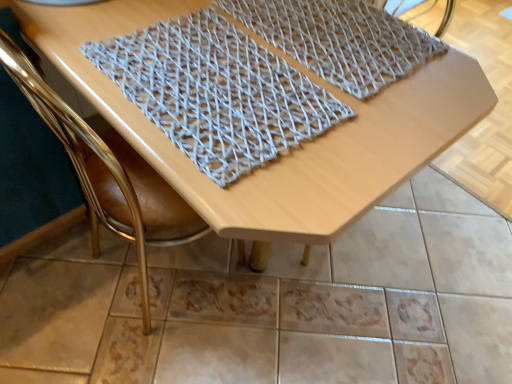
Identify the location of knitted fabric at center, placed as the 1th blanket when sorted from left to right. (216, 92).

This screenshot has height=384, width=512. What do you see at coordinates (216, 92) in the screenshot?
I see `knitted fabric at center, placed as the 1th blanket when sorted from left to right` at bounding box center [216, 92].

The width and height of the screenshot is (512, 384). In order to click on gray woven mat at upper center, acting as the 1th blanket starting from the right in this screenshot , I will do `click(339, 39)`.

Can gold leather chair at upper left be found inside gray woven mat at upper center, acting as the 1th blanket starting from the right?

Actually, gold leather chair at upper left is outside gray woven mat at upper center, acting as the 1th blanket starting from the right.

In the image, is gray woven mat at upper center, which is counted as the second blanket, starting from the left, positioned in front of or behind gold leather chair at upper left?

In the image, gray woven mat at upper center, which is counted as the second blanket, starting from the left, appears behind gold leather chair at upper left.

Considering the relative positions of gray woven mat at upper center, acting as the 1th blanket starting from the right, and gold leather chair at upper left in the image provided, is gray woven mat at upper center, acting as the 1th blanket starting from the right, to the left of gold leather chair at upper left from the viewer's perspective?

No.

Who is taller, gray woven mat at upper center, which is counted as the second blanket, starting from the left, or gold leather chair at upper left?

Standing taller between the two is gold leather chair at upper left.

Are gold leather chair at upper left and gray woven mat at upper center, which is counted as the second blanket, starting from the left, making contact?

No, gold leather chair at upper left is not with gray woven mat at upper center, which is counted as the second blanket, starting from the left.

This screenshot has width=512, height=384. What are the coordinates of `the 2nd blanket above the gold leather chair at upper left (from the image's perspective)` in the screenshot? It's located at (339, 39).

Does gold leather chair at upper left appear on the right side of gray woven mat at upper center, which is counted as the second blanket, starting from the left?

In fact, gold leather chair at upper left is to the left of gray woven mat at upper center, which is counted as the second blanket, starting from the left.

In terms of height, does knitted fabric at center, which ranks as the 2th blanket in right-to-left order, look taller or shorter compared to wooden table at center?

In the image, knitted fabric at center, which ranks as the 2th blanket in right-to-left order, appears to be shorter than wooden table at center.

Is knitted fabric at center, which ranks as the 2th blanket in right-to-left order, positioned in front of wooden table at center?

No, knitted fabric at center, which ranks as the 2th blanket in right-to-left order, is further to the viewer.

Could you measure the distance between knitted fabric at center, placed as the 1th blanket when sorted from left to right, and wooden table at center?

They are 3.33 inches apart.

From a real-world perspective, which object rests below the other?

wooden table at center, from a real-world perspective.

Is wooden table at center facing towards gray woven mat at upper center, acting as the 1th blanket starting from the right?

No, wooden table at center is not aimed at gray woven mat at upper center, acting as the 1th blanket starting from the right.

Is gray woven mat at upper center, acting as the 1th blanket starting from the right, inside wooden table at center?

Yes, wooden table at center contains gray woven mat at upper center, acting as the 1th blanket starting from the right.

From the image's perspective, which object appears higher, wooden table at center or gray woven mat at upper center, which is counted as the second blanket, starting from the left?

gray woven mat at upper center, which is counted as the second blanket, starting from the left, is shown above in the image.

Where is `the 2nd blanket above the wooden table at center (from the image's perspective)`? the 2nd blanket above the wooden table at center (from the image's perspective) is located at coordinates (339, 39).

Considering the sizes of objects knitted fabric at center, which ranks as the 2th blanket in right-to-left order, and gold leather chair at upper left in the image provided, who is bigger, knitted fabric at center, which ranks as the 2th blanket in right-to-left order, or gold leather chair at upper left?

gold leather chair at upper left is bigger.

Based on the photo, is the depth of knitted fabric at center, which ranks as the 2th blanket in right-to-left order, greater than that of gold leather chair at upper left?

Yes, knitted fabric at center, which ranks as the 2th blanket in right-to-left order, is further from the camera.

From a real-world perspective, starting from the gold leather chair at upper left, which blanket is the 1st one vertically above it? Please provide its 2D coordinates.

[(216, 92)]

Is knitted fabric at center, which ranks as the 2th blanket in right-to-left order, far away from gold leather chair at upper left?

knitted fabric at center, which ranks as the 2th blanket in right-to-left order, is near gold leather chair at upper left, not far away.

Which of these two, gold leather chair at upper left or wooden table at center, stands shorter?

wooden table at center.

Is point (93, 236) farther from viewer compared to point (389, 143)?

Yes, point (93, 236) is farther from viewer.

From the image's perspective, is gold leather chair at upper left above or below wooden table at center?

gold leather chair at upper left is below wooden table at center.

Is gold leather chair at upper left not near wooden table at center?

No, gold leather chair at upper left is not far from wooden table at center.

From the image's perspective, relative to knitted fabric at center, placed as the 1th blanket when sorted from left to right, is gold leather chair at upper left above or below?

From the image's perspective, gold leather chair at upper left appears below knitted fabric at center, placed as the 1th blanket when sorted from left to right.

Is the surface of gold leather chair at upper left in direct contact with knitted fabric at center, which ranks as the 2th blanket in right-to-left order?

No, gold leather chair at upper left is not touching knitted fabric at center, which ranks as the 2th blanket in right-to-left order.

In the image, is gold leather chair at upper left positioned in front of or behind knitted fabric at center, which ranks as the 2th blanket in right-to-left order?

In the image, gold leather chair at upper left appears in front of knitted fabric at center, which ranks as the 2th blanket in right-to-left order.

The image size is (512, 384). Find the location of `chair in front of the gray woven mat at upper center, acting as the 1th blanket starting from the right`. chair in front of the gray woven mat at upper center, acting as the 1th blanket starting from the right is located at coordinates (108, 174).

This screenshot has width=512, height=384. In order to click on chair beneath the gray woven mat at upper center, acting as the 1th blanket starting from the right (from a real-world perspective) in this screenshot , I will do `click(108, 174)`.

When comparing their distances from knitted fabric at center, which ranks as the 2th blanket in right-to-left order, does gray woven mat at upper center, which is counted as the second blanket, starting from the left, or wooden table at center seem closer?

Based on the image, wooden table at center appears to be nearer to knitted fabric at center, which ranks as the 2th blanket in right-to-left order.

From the image, which object appears to be nearer to knitted fabric at center, placed as the 1th blanket when sorted from left to right, gray woven mat at upper center, acting as the 1th blanket starting from the right, or gold leather chair at upper left?

The object closer to knitted fabric at center, placed as the 1th blanket when sorted from left to right, is gray woven mat at upper center, acting as the 1th blanket starting from the right.

Estimate the real-world distances between objects in this image. Which object is further from gray woven mat at upper center, acting as the 1th blanket starting from the right, gold leather chair at upper left or wooden table at center?

Among the two, gold leather chair at upper left is located further to gray woven mat at upper center, acting as the 1th blanket starting from the right.

Considering their positions, is gray woven mat at upper center, which is counted as the second blanket, starting from the left, positioned further to wooden table at center than knitted fabric at center, which ranks as the 2th blanket in right-to-left order?

Among the two, gray woven mat at upper center, which is counted as the second blanket, starting from the left, is located further to wooden table at center.

Based on their spatial positions, is knitted fabric at center, placed as the 1th blanket when sorted from left to right, or gray woven mat at upper center, which is counted as the second blanket, starting from the left, closer to gold leather chair at upper left?

knitted fabric at center, placed as the 1th blanket when sorted from left to right.

Looking at this image, when comparing their distances from gold leather chair at upper left, does wooden table at center or gray woven mat at upper center, acting as the 1th blanket starting from the right, seem further?

gray woven mat at upper center, acting as the 1th blanket starting from the right.

Estimate the real-world distances between objects in this image. Which object is further from knitted fabric at center, which ranks as the 2th blanket in right-to-left order, wooden table at center or gold leather chair at upper left?

Among the two, gold leather chair at upper left is located further to knitted fabric at center, which ranks as the 2th blanket in right-to-left order.

Estimate the real-world distances between objects in this image. Which object is closer to gray woven mat at upper center, acting as the 1th blanket starting from the right, wooden table at center or gold leather chair at upper left?

The object closer to gray woven mat at upper center, acting as the 1th blanket starting from the right, is wooden table at center.

Identify the location of blanket between wooden table at center and gray woven mat at upper center, acting as the 1th blanket starting from the right. This screenshot has width=512, height=384. (216, 92).

You are a GUI agent. You are given a task and a screenshot of the screen. Output one action in this format:
    pyautogui.click(x=<x>, y=<y>)
    Task: Click on the table that lies between knitted fabric at center, which ranks as the 2th blanket in right-to-left order, and gold leather chair at upper left from top to bottom
    The width and height of the screenshot is (512, 384).
    Given the screenshot: What is the action you would take?
    pyautogui.click(x=292, y=150)

Where is `table situated between gold leather chair at upper left and gray woven mat at upper center, acting as the 1th blanket starting from the right, from left to right`? The image size is (512, 384). table situated between gold leather chair at upper left and gray woven mat at upper center, acting as the 1th blanket starting from the right, from left to right is located at coordinates (292, 150).

Locate an element on the screen. The height and width of the screenshot is (384, 512). blanket between gold leather chair at upper left and gray woven mat at upper center, which is counted as the second blanket, starting from the left is located at coordinates (216, 92).